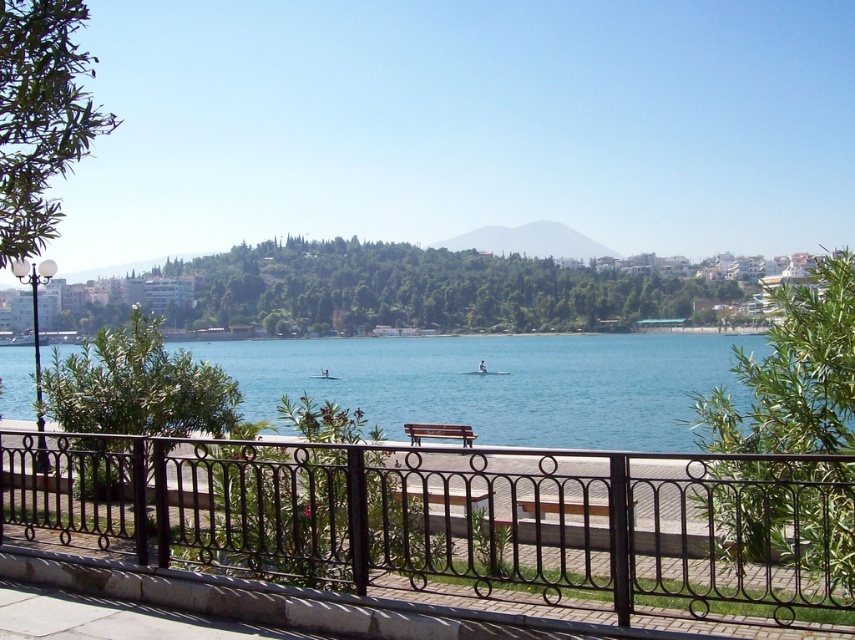
You are a painter standing on the walkway and want to paint the blue water at center and the wooden bench at center. Which object appears taller in your painting?

The blue water at center appears taller than the wooden bench at center in the painting.

You are planning to place a new bench that is the same size as the wooden bench at center in the image. If you want to ensure it fits within the blue water at center area, will it be possible?

The blue water at center is bigger than the wooden bench at center, so placing a bench of the same size within the blue water at center area would be possible as there is enough space.

You are standing at the edge of the waterfront walkway and want to take a photo of the black wrought iron fence at center. Your camera is placed 4.39 meters away from the fence. Is the camera positioned far enough to capture the entire fence in one shot?

The black wrought iron fence at center and camera are 4.39 meters apart from each other. To determine if the camera is positioned far enough, you would need to consider the field of view of the camera lens and the size of the fence. However, based on the given information alone, the distance matches the required separation, so the camera is placed exactly at the specified distance of 4.39 meters.